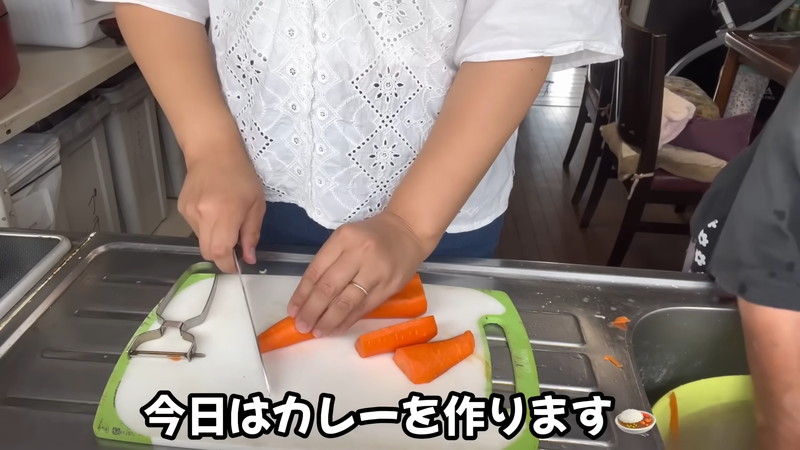
Where is `counter top`? The height and width of the screenshot is (450, 800). counter top is located at coordinates (60, 70).